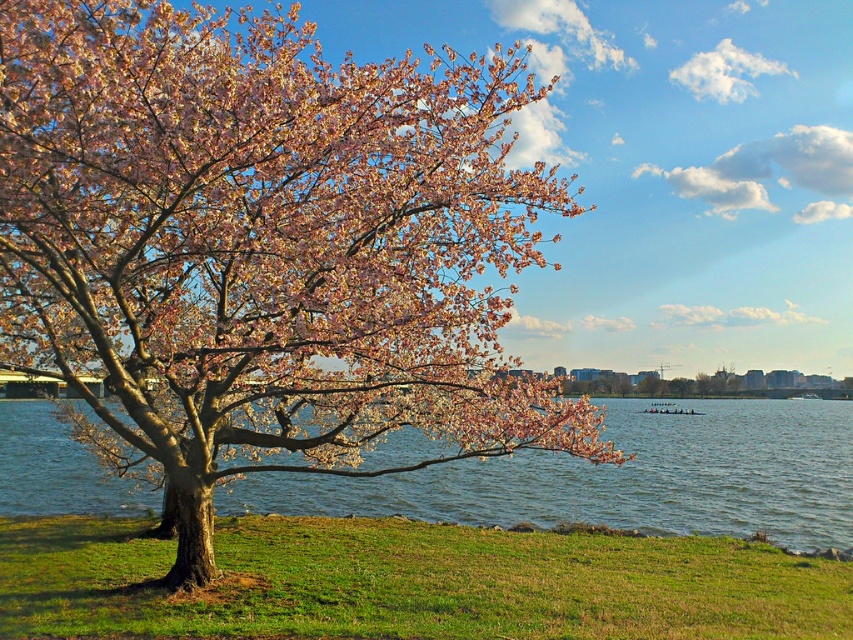
Question: Among these points, which one is nearest to the camera?

Choices:
 (A) (732, 420)
 (B) (302, 74)

Answer: (B)

Question: Is pink bloom at center positioned before blue water at center?

Choices:
 (A) yes
 (B) no

Answer: (A)

Question: Which object is closer to the camera taking this photo?

Choices:
 (A) pink bloom at center
 (B) blue water at center

Answer: (A)

Question: Can you confirm if pink bloom at center is bigger than blue water at center?

Choices:
 (A) no
 (B) yes

Answer: (B)

Question: Does pink bloom at center have a smaller size compared to blue water at center?

Choices:
 (A) no
 (B) yes

Answer: (A)